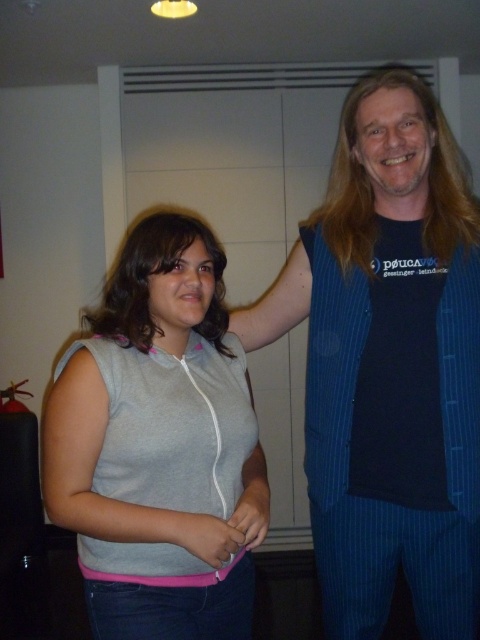
Question: Which of the following is the closest to the observer?

Choices:
 (A) pink fabric hand at center
 (B) blue pinstripe vest at center
 (C) gray fabric sleeveless top at center

Answer: (C)

Question: Is gray fabric sleeveless top at center to the right of pink fabric hand at center from the viewer's perspective?

Choices:
 (A) yes
 (B) no

Answer: (B)

Question: Does blue pinstripe vest at center appear under gray fabric sleeveless top at center?

Choices:
 (A) no
 (B) yes

Answer: (A)

Question: Which of the following is the farthest from the observer?

Choices:
 (A) (356, 609)
 (B) (171, 513)
 (C) (100, 556)

Answer: (A)

Question: Among these objects, which one is farthest from the camera?

Choices:
 (A) pink fabric hand at center
 (B) gray fabric sleeveless top at center
 (C) blue pinstripe vest at center

Answer: (C)

Question: Does gray fabric sleeveless top at center have a larger size compared to pink fabric hand at center?

Choices:
 (A) yes
 (B) no

Answer: (A)